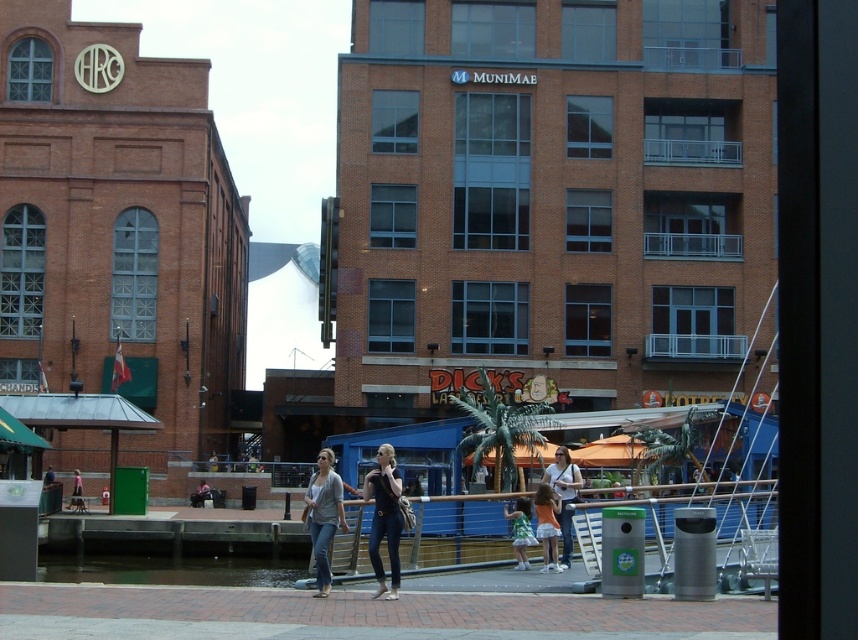
Question: Is matte white shirt at center smaller than green jersey at center?

Choices:
 (A) yes
 (B) no

Answer: (B)

Question: Which point is closer to the camera taking this photo?

Choices:
 (A) (551, 477)
 (B) (80, 483)
 (C) (529, 508)
 (D) (324, 529)

Answer: (D)

Question: Does matte white shirt at center have a larger size compared to green jersey at center?

Choices:
 (A) yes
 (B) no

Answer: (A)

Question: Is black denim jeans at center closer to the viewer compared to light pink fabric at lower left?

Choices:
 (A) yes
 (B) no

Answer: (A)

Question: Which object is farther from the camera taking this photo?

Choices:
 (A) green jersey at center
 (B) clear water at lower center

Answer: (B)

Question: Which of these objects is positioned farthest from the denim jeans at center?

Choices:
 (A) matte white shirt at center
 (B) black denim jeans at center

Answer: (A)